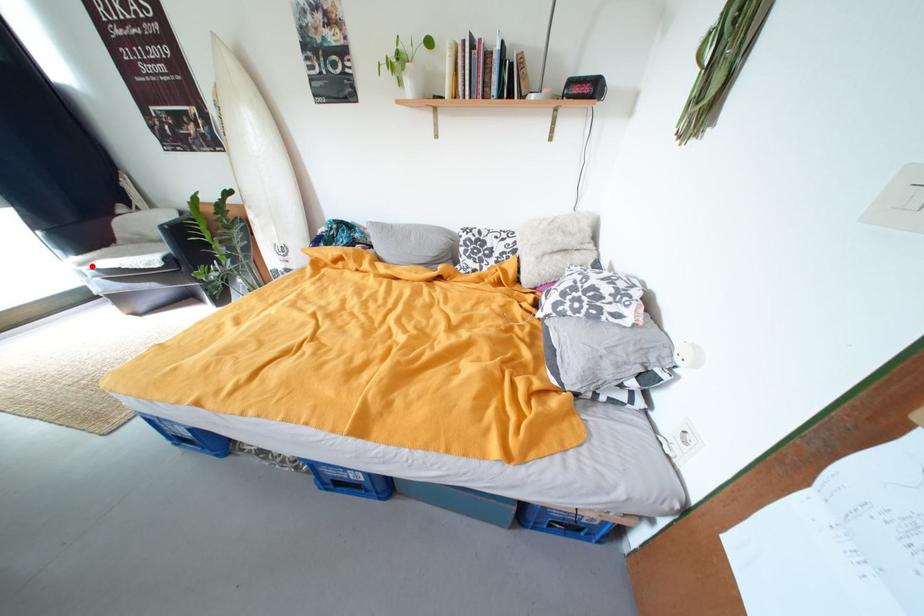
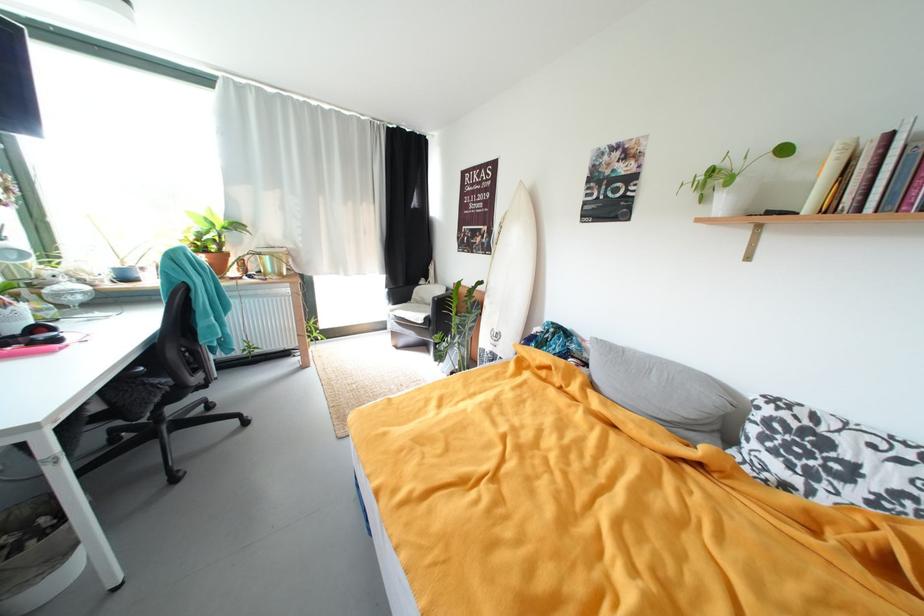
Locate, in the second image, the point that corresponds to the highlighted location in the first image.

(399, 313)